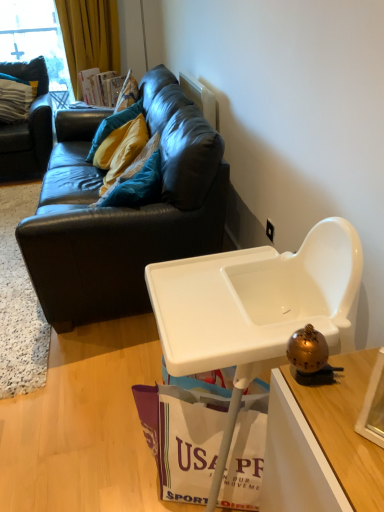
What do you see at coordinates (310, 357) in the screenshot?
I see `gold metallic bell at right` at bounding box center [310, 357].

The image size is (384, 512). In order to click on black leather couch at upper left, the first studio couch positioned from the right in this screenshot , I will do `click(112, 252)`.

Describe the element at coordinates (137, 180) in the screenshot. I see `teal fabric pillow at upper left, positioned as the 2th pillow in back-to-front order` at that location.

In order to face dark brown leather couch at upper left, the 2th studio couch positioned from the right, should I rotate leftwards or rightwards?

Turn left approximately 22.175 degrees to face it.

What is the approximate width of white plastic power outlet at upper right?

It is 0.63 inches.

The height and width of the screenshot is (512, 384). What do you see at coordinates (183, 436) in the screenshot?
I see `white paper shopping bag at lower center` at bounding box center [183, 436].

Image resolution: width=384 pixels, height=512 pixels. What do you see at coordinates (15, 98) in the screenshot?
I see `teal fabric pillow at upper left, the first pillow from the left` at bounding box center [15, 98].

This screenshot has width=384, height=512. What are the coordinates of `gold metallic bell at right` in the screenshot? It's located at (310, 357).

Between point (44, 163) and point (266, 232), which one is positioned in front?

The point (266, 232) is more forward.

How different are the orientations of dark brown leather couch at upper left, the 2th studio couch positioned from the right, and white plastic power outlet at upper right in degrees?

88.2 degrees.

From the picture: Does dark brown leather couch at upper left, the first studio couch in the left-to-right sequence, have a greater height compared to white plastic power outlet at upper right?

Yes, dark brown leather couch at upper left, the first studio couch in the left-to-right sequence, is taller than white plastic power outlet at upper right.

Which is more to the right, dark brown leather couch at upper left, the first studio couch in the left-to-right sequence, or white plastic power outlet at upper right?

white plastic power outlet at upper right is more to the right.

Does gold metallic bell at right turn towards white paper shopping bag at lower center?

No, gold metallic bell at right is not facing towards white paper shopping bag at lower center.

Considering the sizes of objects gold metallic bell at right and white paper shopping bag at lower center in the image provided, who is shorter, gold metallic bell at right or white paper shopping bag at lower center?

gold metallic bell at right is shorter.

Can you confirm if gold metallic bell at right is positioned to the left of white paper shopping bag at lower center?

In fact, gold metallic bell at right is to the right of white paper shopping bag at lower center.

Is white paper shopping bag at lower center oriented towards white plastic power outlet at upper right?

No, white paper shopping bag at lower center does not turn towards white plastic power outlet at upper right.

Visually, is white paper shopping bag at lower center positioned to the left or to the right of white plastic power outlet at upper right?

white paper shopping bag at lower center is positioned on white plastic power outlet at upper right's left side.

This screenshot has height=512, width=384. What are the coordinates of `shopping bag on the left of white plastic power outlet at upper right` in the screenshot? It's located at (183, 436).

Would you say white paper shopping bag at lower center is outside white plastic power outlet at upper right?

Absolutely, white paper shopping bag at lower center is external to white plastic power outlet at upper right.

Considering the relative sizes of gold metallic bell at right and white plastic power outlet at upper right in the image provided, is gold metallic bell at right smaller than white plastic power outlet at upper right?

Actually, gold metallic bell at right might be larger than white plastic power outlet at upper right.

Where is `toy below the white plastic power outlet at upper right (from the image's perspective)`? The height and width of the screenshot is (512, 384). toy below the white plastic power outlet at upper right (from the image's perspective) is located at coordinates (310, 357).

Is gold metallic bell at right next to white plastic power outlet at upper right and touching it?

No, gold metallic bell at right is not next to white plastic power outlet at upper right.

From a real-world perspective, does gold metallic bell at right stand above white plastic power outlet at upper right?

Yes, from a real-world perspective, gold metallic bell at right is above white plastic power outlet at upper right.

From a real-world perspective, count 2nd studio couchs downward from the teal fabric pillow at upper left, the second pillow in the left-to-right sequence, and point to it. Please provide its 2D coordinates.

[(112, 252)]

Between black leather couch at upper left, the first studio couch positioned from the right, and teal fabric pillow at upper left, arranged as the second pillow when viewed from the top, which one has less height?

teal fabric pillow at upper left, arranged as the second pillow when viewed from the top.

Are black leather couch at upper left, which ranks as the 2th studio couch in left-to-right order, and teal fabric pillow at upper left, positioned as the 2th pillow in back-to-front order, located far from each other?

No, black leather couch at upper left, which ranks as the 2th studio couch in left-to-right order, is not far from teal fabric pillow at upper left, positioned as the 2th pillow in back-to-front order.

How different are the orientations of black leather couch at upper left, which ranks as the 2th studio couch in left-to-right order, and teal fabric pillow at upper left, marked as the first pillow in a right-to-left arrangement, in degrees?

They differ by 3.9 degrees in their facing directions.

Does point (59, 285) come in front of point (324, 359)?

No, it is not.

Is black leather couch at upper left, the first studio couch positioned from the right, next to gold metallic bell at right and touching it?

There is a gap between black leather couch at upper left, the first studio couch positioned from the right, and gold metallic bell at right.

From a real-world perspective, is black leather couch at upper left, the first studio couch positioned from the right, above or below gold metallic bell at right?

Clearly, from a real-world perspective, black leather couch at upper left, the first studio couch positioned from the right, is below gold metallic bell at right.

How different are the orientations of white plastic power outlet at upper right and gold metallic bell at right in degrees?

white plastic power outlet at upper right and gold metallic bell at right are facing 2.59 degrees away from each other.

Between white plastic power outlet at upper right and gold metallic bell at right, which one has less height?

white plastic power outlet at upper right.

Where is `toy lying on the left of white plastic power outlet at upper right`? This screenshot has height=512, width=384. toy lying on the left of white plastic power outlet at upper right is located at coordinates (310, 357).

From the image's perspective, which is below, white plastic power outlet at upper right or gold metallic bell at right?

gold metallic bell at right.

Image resolution: width=384 pixels, height=512 pixels. I want to click on studio couch that is the 2nd one above the white plastic power outlet at upper right (from a real-world perspective), so click(27, 128).

Locate an element on the screen. This screenshot has width=384, height=512. shopping bag lying on the left of gold metallic bell at right is located at coordinates (183, 436).

In the scene shown: When comparing their distances from black leather couch at upper left, the first studio couch positioned from the right, does white paper shopping bag at lower center or white plastic highchair at lower right seem further?

white paper shopping bag at lower center.

Based on their spatial positions, is white paper shopping bag at lower center or teal fabric pillow at upper left, which appears as the first pillow when ordered from the bottom, further from white plastic highchair at lower right?

teal fabric pillow at upper left, which appears as the first pillow when ordered from the bottom, is positioned further to the anchor white plastic highchair at lower right.

When comparing their distances from dark brown leather couch at upper left, the first studio couch in the left-to-right sequence, does white paper shopping bag at lower center or teal fabric pillow at upper left, marked as the first pillow in a right-to-left arrangement, seem closer?

teal fabric pillow at upper left, marked as the first pillow in a right-to-left arrangement, lies closer to dark brown leather couch at upper left, the first studio couch in the left-to-right sequence, than the other object.

Based on their spatial positions, is dark brown leather couch at upper left, the first studio couch in the left-to-right sequence, or white plastic power outlet at upper right closer to white plastic highchair at lower right?

white plastic power outlet at upper right lies closer to white plastic highchair at lower right than the other object.

Estimate the real-world distances between objects in this image. Which object is further from gold metallic bell at right, black leather couch at upper left, which ranks as the 2th studio couch in left-to-right order, or white paper shopping bag at lower center?

black leather couch at upper left, which ranks as the 2th studio couch in left-to-right order.

Considering their positions, is gold metallic bell at right positioned further to white paper shopping bag at lower center than white plastic highchair at lower right?

gold metallic bell at right is further to white paper shopping bag at lower center.

Estimate the real-world distances between objects in this image. Which object is closer to black leather couch at upper left, the first studio couch positioned from the right, teal fabric pillow at upper left, placed as the 2th pillow when sorted from right to left, or teal fabric pillow at upper left, marked as the first pillow in a right-to-left arrangement?

teal fabric pillow at upper left, marked as the first pillow in a right-to-left arrangement, lies closer to black leather couch at upper left, the first studio couch positioned from the right, than the other object.

Considering their positions, is dark brown leather couch at upper left, the 2th studio couch positioned from the right, positioned closer to white plastic highchair at lower right than teal fabric pillow at upper left, which appears as the first pillow when ordered from the bottom?

The object closer to white plastic highchair at lower right is teal fabric pillow at upper left, which appears as the first pillow when ordered from the bottom.

Find the location of a particular element. table between gold metallic bell at right and white plastic power outlet at upper right in the front-back direction is located at coordinates (255, 308).

You are a GUI agent. You are given a task and a screenshot of the screen. Output one action in this format:
    pyautogui.click(x=<x>, y=<y>)
    Task: Click on the studio couch positioned between white plastic highchair at lower right and white plastic power outlet at upper right from near to far
    
    Given the screenshot: What is the action you would take?
    pyautogui.click(x=112, y=252)

Where is `power outlet located between white plastic highchair at lower right and teal fabric pillow at upper left, marked as the first pillow in a right-to-left arrangement, in the depth direction`? The image size is (384, 512). power outlet located between white plastic highchair at lower right and teal fabric pillow at upper left, marked as the first pillow in a right-to-left arrangement, in the depth direction is located at coordinates (270, 230).

Find the location of a particular element. pillow between dark brown leather couch at upper left, the 2th studio couch positioned from the right, and white plastic power outlet at upper right, in the horizontal direction is located at coordinates (137, 180).